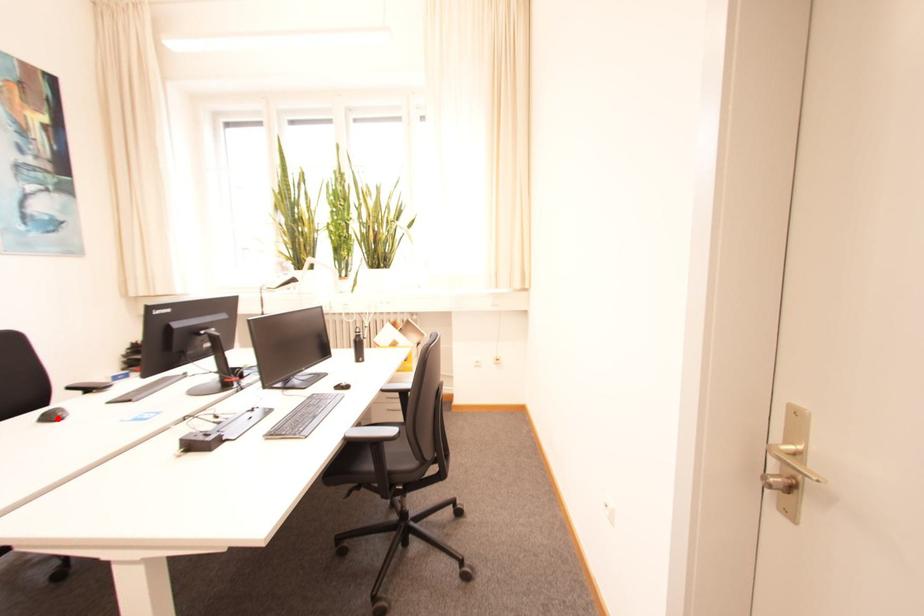
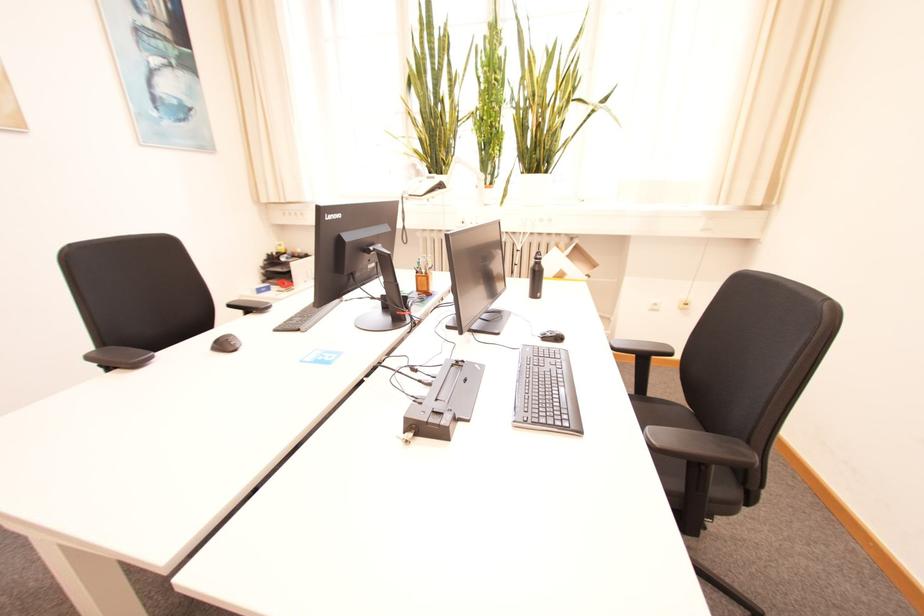
Where in the second image is the point corresponding to the highlighted location from the first image?

(229, 346)